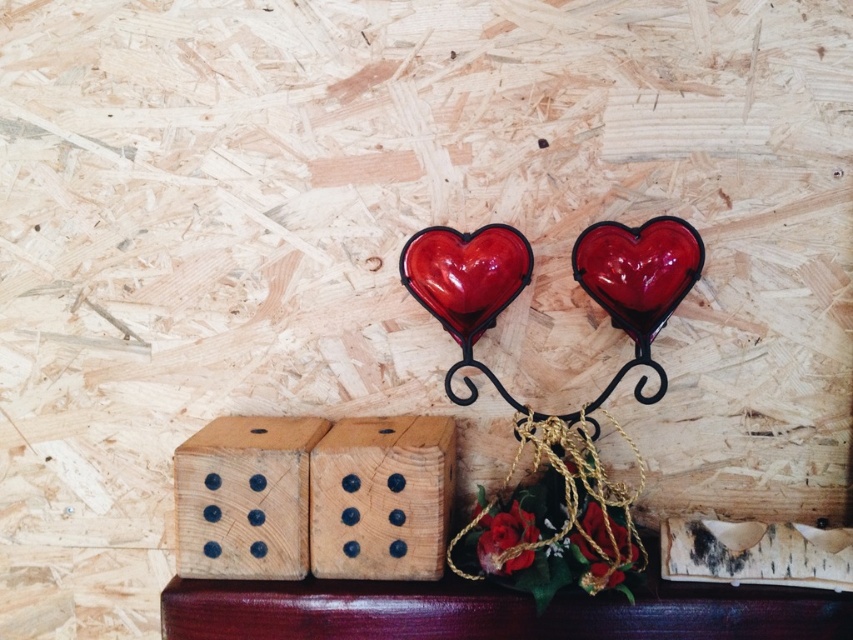
Does wooden die at center appear under natural wood domino at lower left?

Indeed, wooden die at center is positioned under natural wood domino at lower left.

Which of these two, wooden die at center or natural wood domino at lower left, stands shorter?

With less height is natural wood domino at lower left.

Between point (412, 440) and point (183, 570), which one is positioned in front?

Point (183, 570) is in front.

Locate an element on the screen. The height and width of the screenshot is (640, 853). wooden die at center is located at coordinates (381, 497).

Who is taller, natural wood domino at lower left or gold metallic chain at center?

gold metallic chain at center

Which is more to the left, natural wood domino at lower left or gold metallic chain at center?

From the viewer's perspective, natural wood domino at lower left appears more on the left side.

Where is `natural wood domino at lower left`? The image size is (853, 640). natural wood domino at lower left is located at coordinates (244, 497).

Who is shorter, wooden die at center or gold metallic chain at center?

With less height is wooden die at center.

Looking at this image, between wooden die at center and gold metallic chain at center, which one is positioned lower?

Positioned lower is gold metallic chain at center.

You are a GUI agent. You are given a task and a screenshot of the screen. Output one action in this format:
    pyautogui.click(x=<x>, y=<y>)
    Task: Click on the wooden die at center
    
    Given the screenshot: What is the action you would take?
    pyautogui.click(x=381, y=497)

Where is `wooden die at center`? wooden die at center is located at coordinates (381, 497).